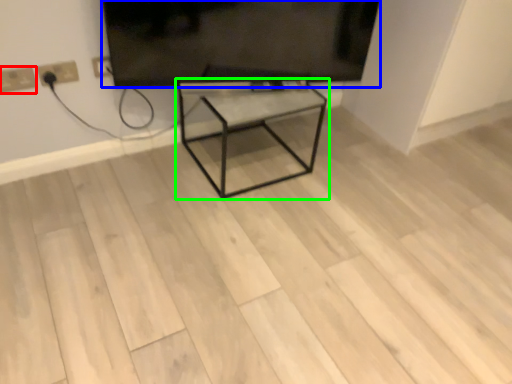
Question: Which object is the closest to the electric outlet (highlighted by a red box)? Choose among these: television (highlighted by a blue box) or table (highlighted by a green box).

Choices:
 (A) television
 (B) table

Answer: (A)